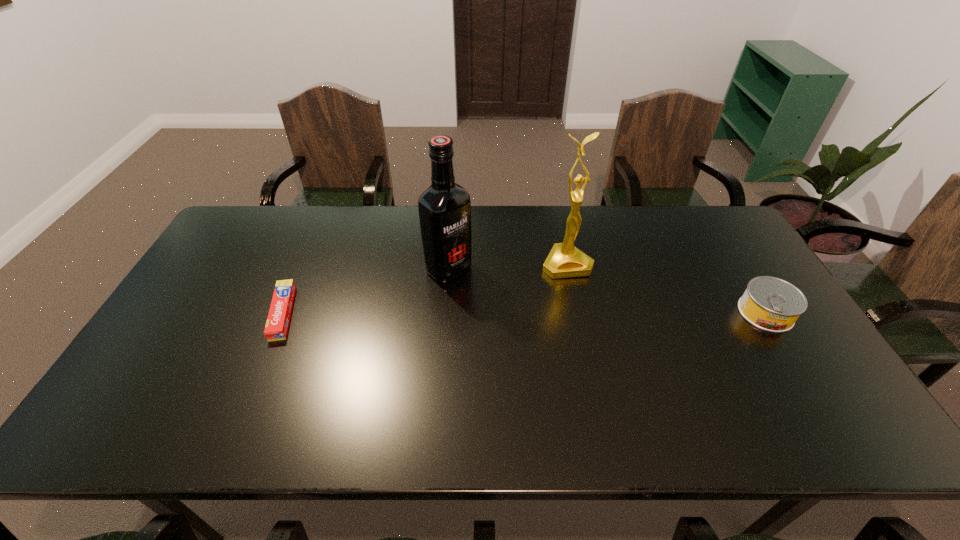
Locate an element on the screen. The width and height of the screenshot is (960, 540). the leftmost object is located at coordinates (277, 324).

At what (x,y) coordinates should I click in order to perform the action: click on toothpaste. Please return your answer as a coordinate pair (x, y). Looking at the image, I should click on (277, 324).

Locate an element on the screen. Image resolution: width=960 pixels, height=540 pixels. the rightmost object is located at coordinates 771,304.

Image resolution: width=960 pixels, height=540 pixels. I want to click on the second shortest object, so click(x=771, y=304).

Where is `the third object from right to left`? Image resolution: width=960 pixels, height=540 pixels. the third object from right to left is located at coordinates (444, 208).

Identify the location of award. tap(565, 260).

Locate an element on the screen. The image size is (960, 540). free space located on the back of the leftmost object is located at coordinates [x=325, y=212].

In order to click on free spot located on the back of the can in this screenshot , I will do `click(738, 268)`.

At what (x,y) coordinates should I click in order to perform the action: click on free space located on the front-facing side of the second object from left to right. Please return your answer as a coordinate pair (x, y). The image size is (960, 540). Looking at the image, I should click on (481, 295).

Where is `vacant area situated on the front-facing side of the second object from left to right`? The width and height of the screenshot is (960, 540). vacant area situated on the front-facing side of the second object from left to right is located at coordinates (553, 354).